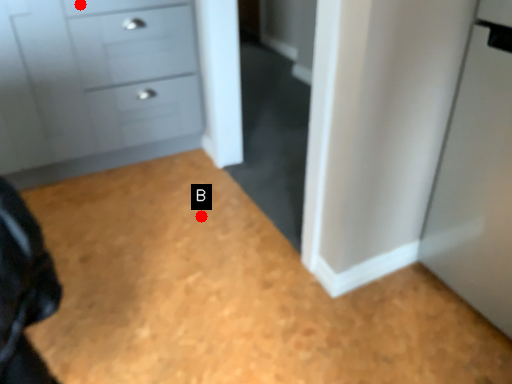
Question: Two points are circled on the image, labeled by A and B beside each circle. Which point appears farthest from the camera in this image?

Choices:
 (A) A is further
 (B) B is further

Answer: (B)